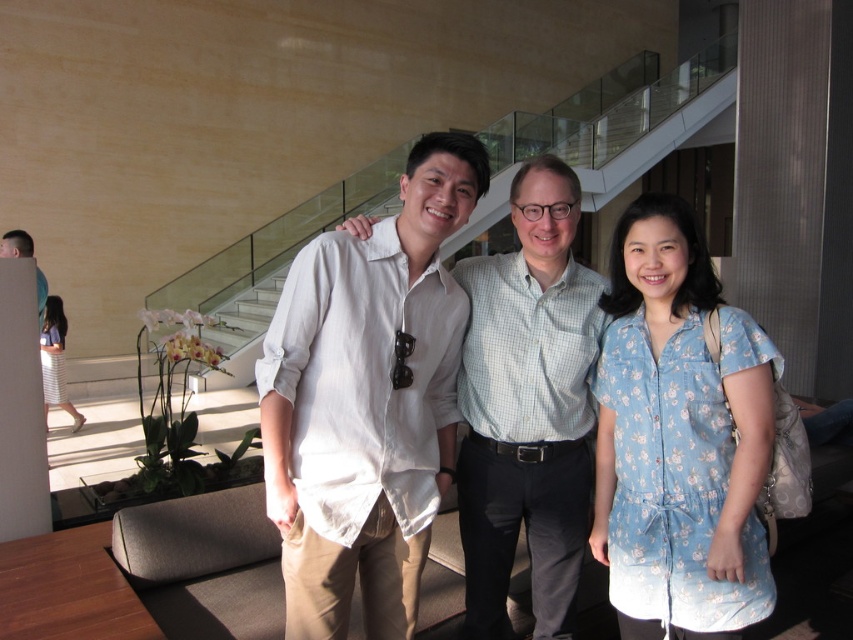
Who is positioned more to the left, white linen shirt at center or matte black shirt at left?

From the viewer's perspective, matte black shirt at left appears more on the left side.

Does white linen shirt at center appear under matte black shirt at left?

Yes.

Image resolution: width=853 pixels, height=640 pixels. Find the location of `white linen shirt at center`. white linen shirt at center is located at coordinates (367, 401).

Is white cotton shirt at center positioned before blue floral dress at center?

That is False.

Which of these two, white cotton shirt at center or blue floral dress at center, stands shorter?

blue floral dress at center

Which is in front, point (370, 403) or point (682, 204)?

Point (370, 403) is in front.

The image size is (853, 640). I want to click on white cotton shirt at center, so click(x=427, y=401).

Does light blue floral dress at lower left appear under matte black shirt at left?

Indeed, light blue floral dress at lower left is positioned under matte black shirt at left.

Describe the element at coordinates (55, 358) in the screenshot. The width and height of the screenshot is (853, 640). I see `light blue floral dress at lower left` at that location.

Where is `light blue floral dress at lower left`? Image resolution: width=853 pixels, height=640 pixels. light blue floral dress at lower left is located at coordinates (55, 358).